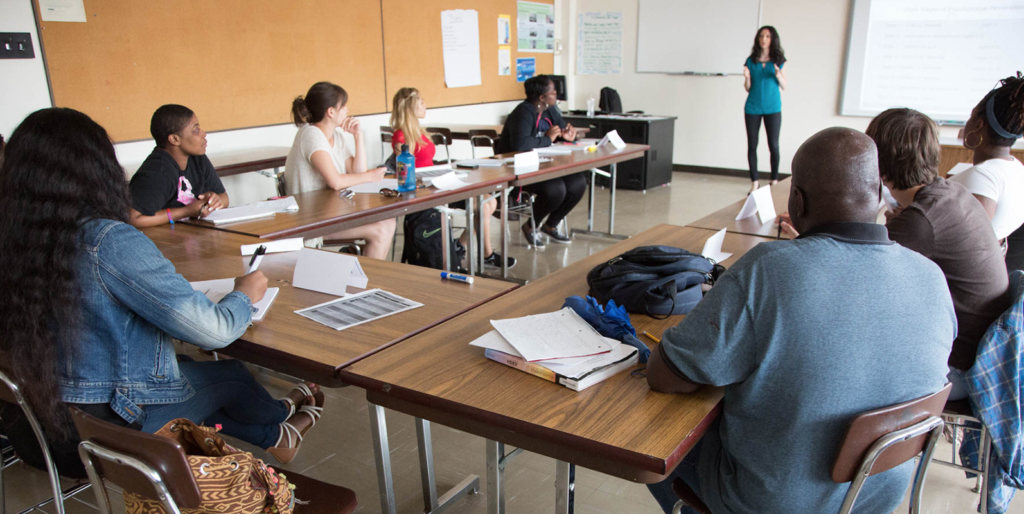
Identify the location of chair backs. (127, 446), (22, 389), (442, 130), (475, 131), (382, 134), (911, 411).